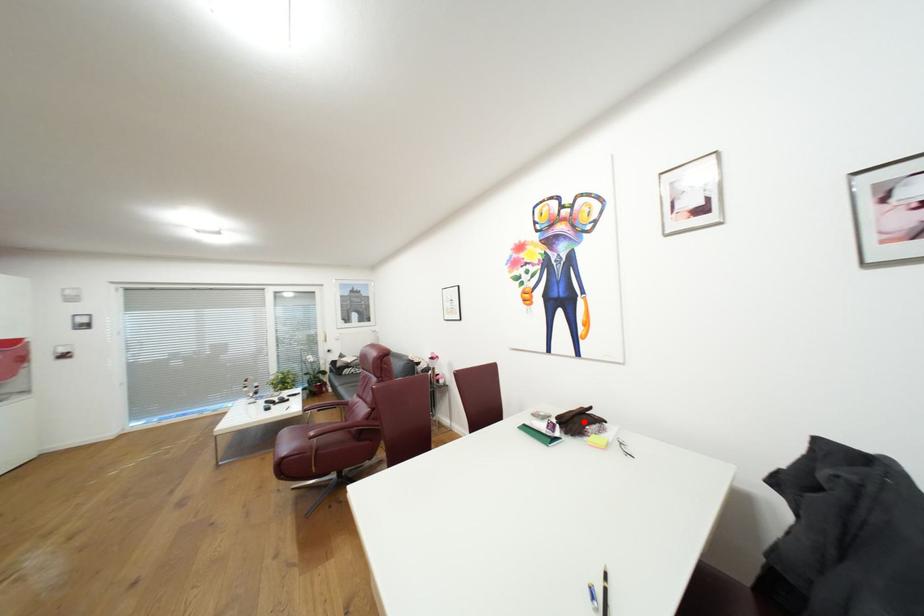
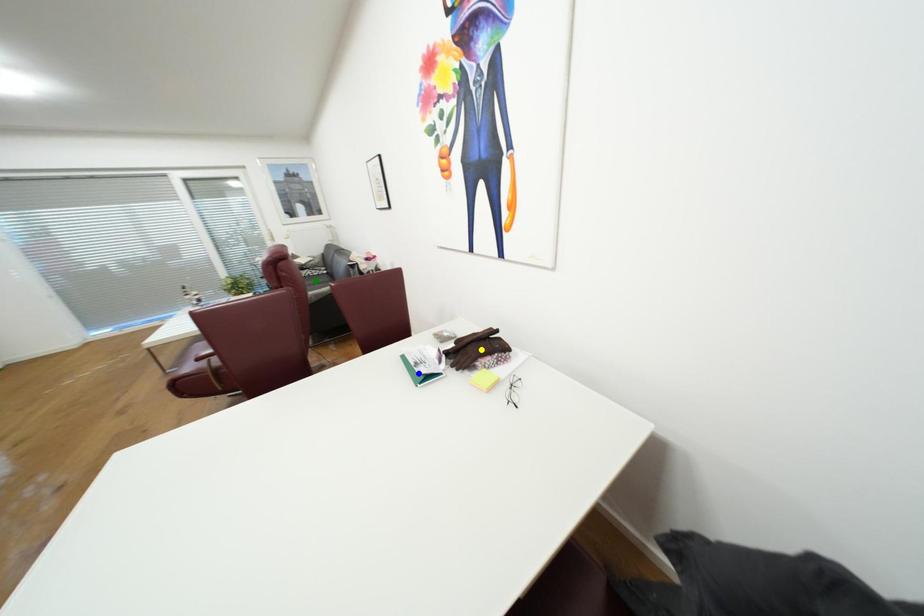
Question: I am providing you with two images of the same scene from different viewpoints. A red point is marked on the first image. You are given multiple points on the second image. Which mark in image 2 goes with the point in image 1?

Choices:
 (A) yellow point
 (B) green point
 (C) blue point

Answer: (A)